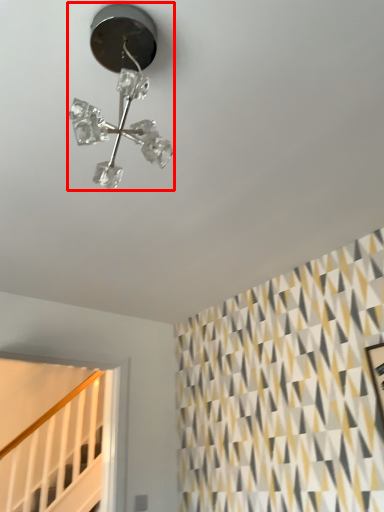
Question: From the image's perspective, considering the relative positions of lamp (annotated by the red box) and stairwell in the image provided, where is lamp (annotated by the red box) located with respect to the staircase?

Choices:
 (A) below
 (B) above

Answer: (B)